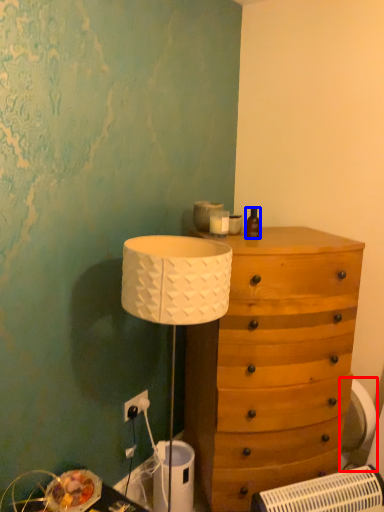
Question: Among these objects, which one is farthest to the camera, swivel chair (highlighted by a red box) or bottle (highlighted by a blue box)?

Choices:
 (A) swivel chair
 (B) bottle

Answer: (A)